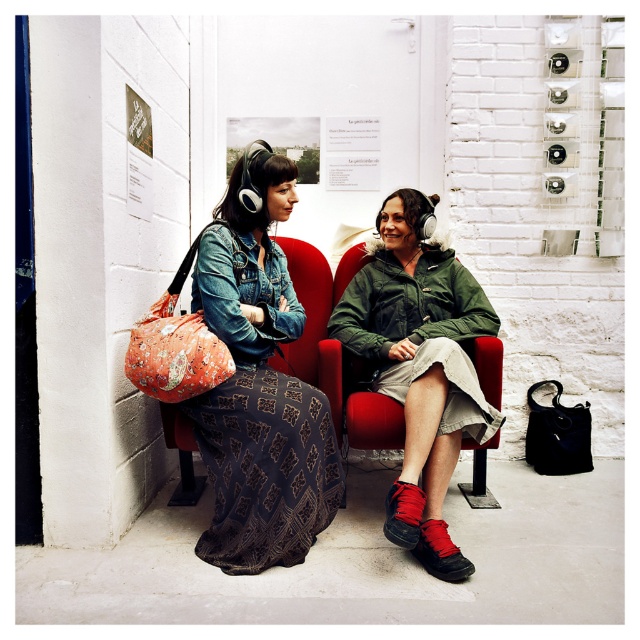
Who is lower down, denim jacket at left or green matte jacket at center?

Positioned lower is green matte jacket at center.

Is denim jacket at left closer to camera compared to green matte jacket at center?

No, denim jacket at left is further to the viewer.

The height and width of the screenshot is (640, 640). I want to click on denim jacket at left, so click(x=259, y=385).